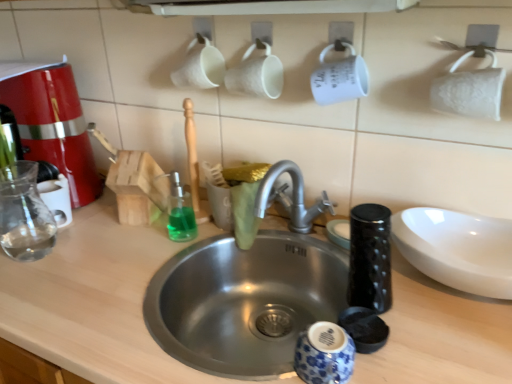
At what (x,y) coordinates should I click in order to perform the action: click on free spot above stainless steel sink at center (from a real-world perspective). Please return your answer as a coordinate pair (x, y). Looking at the image, I should click on (225, 241).